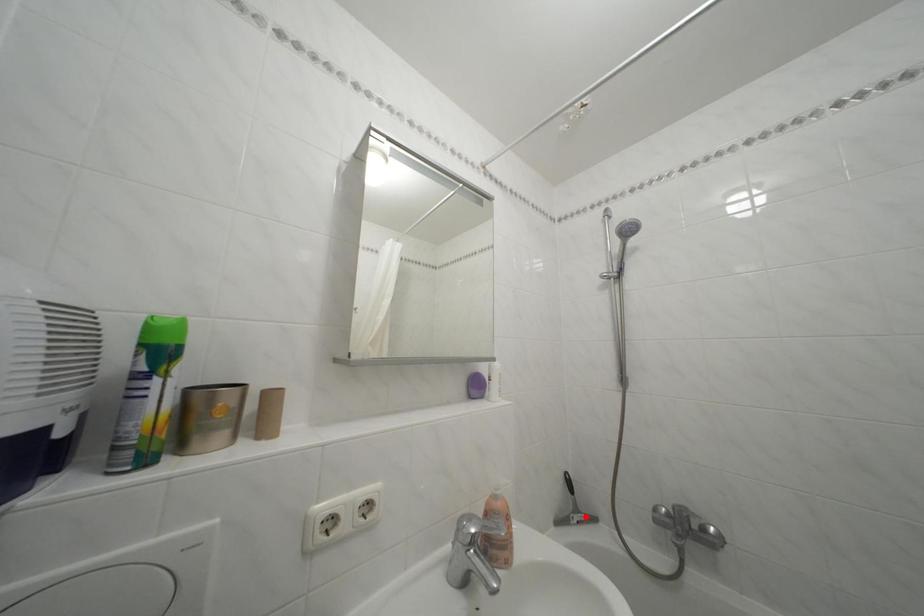
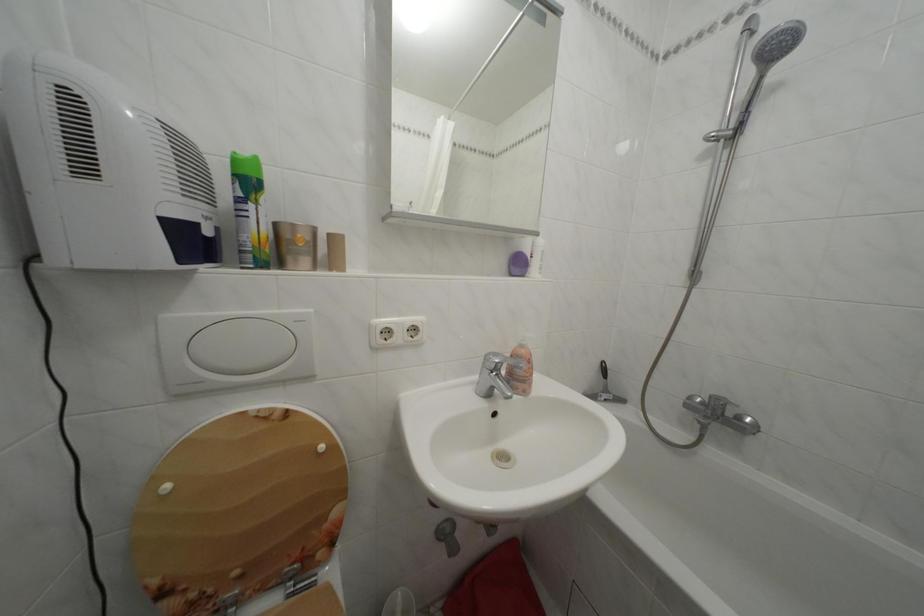
Question: I am providing you with two images of the same scene from different viewpoints. A red point is shown in image1. For the corresponding object point in image2, is it positioned nearer or farther from the camera?

Choices:
 (A) Nearer
 (B) Farther

Answer: (B)